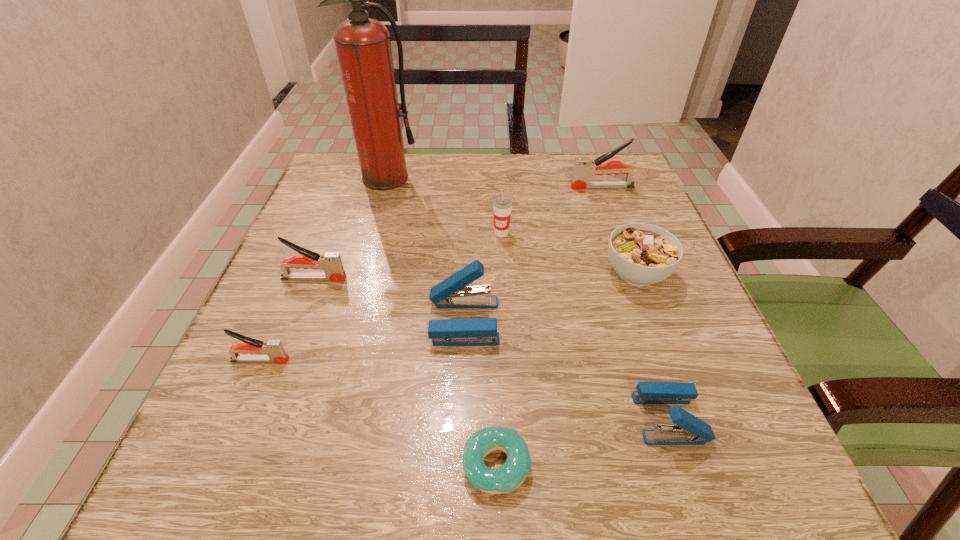
In the image, there is a desktop. Where is `vacant space at the near left corner`? vacant space at the near left corner is located at coordinates pos(309,444).

Identify the location of free space at the far right corner of the desktop. The width and height of the screenshot is (960, 540). (629, 162).

Locate an element on the screen. The width and height of the screenshot is (960, 540). vacant region between the shortest object and the second farthest stapler is located at coordinates (405, 372).

Locate an element on the screen. Image resolution: width=960 pixels, height=540 pixels. vacant space that's between the doughnut and the third farthest stapler is located at coordinates (480, 393).

Identify the location of vacant space that is in between the left blue stapler and the tallest object. The image size is (960, 540). (425, 249).

The height and width of the screenshot is (540, 960). I want to click on free point between the red cup and the rightmost gray stapler, so click(x=552, y=210).

Locate an element on the screen. This screenshot has height=540, width=960. free spot between the second smallest gray stapler and the shortest object is located at coordinates (405, 372).

At what (x,y) coordinates should I click in order to perform the action: click on unoccupied position between the shortest object and the cup. Please return your answer as a coordinate pair (x, y). Looking at the image, I should click on (499, 349).

Where is `vacant space that is in between the tallest object and the tallest stapler`? This screenshot has width=960, height=540. vacant space that is in between the tallest object and the tallest stapler is located at coordinates (494, 183).

This screenshot has height=540, width=960. I want to click on free spot between the second farthest gray stapler and the cup, so click(408, 256).